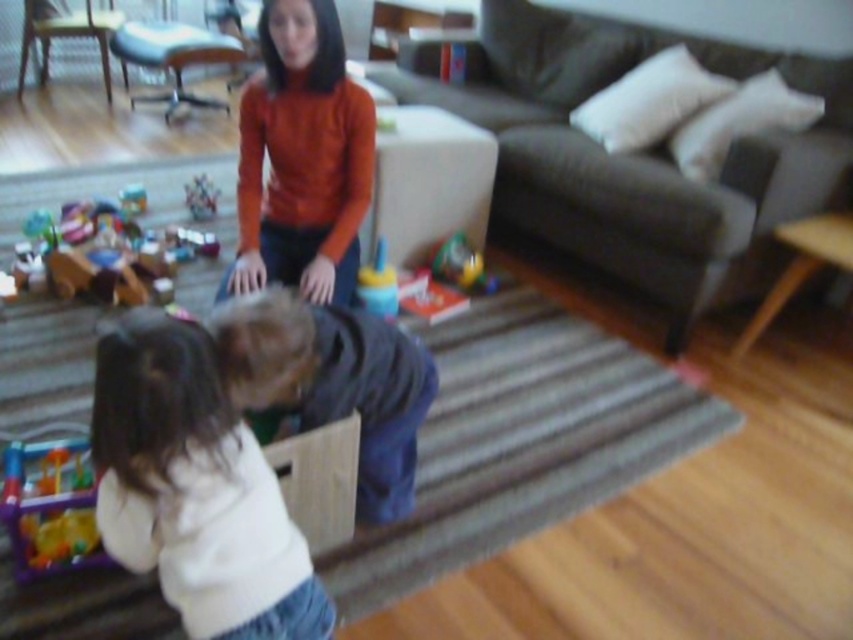
You are a parent trying to organize the toys in the living room. You see the wooden toy car at lower left and the translucent plastic toy at lower left. Which toy is positioned more to the left side of the living room?

The wooden toy car at lower left is positioned more to the left side of the living room than the translucent plastic toy at lower left.

You are a parent trying to pack up the wooden toy car at lower left and the translucent plastic toy at lower left into a storage box. The box can only fit one of them. Which toy should you choose based on their widths?

The wooden toy car at lower left might be wider than translucent plastic toy at lower left, so you should choose the wooden toy car at lower left to fit into the storage box since it is wider and might not fit both.

You are a parent trying to clean up the living room. You see the dark blue fabric at center and the matte plastic toy at center. Which item should you pick up first if you want to start with the taller object?

The dark blue fabric at center has a greater height compared to the matte plastic toy at center, so you should pick up the dark blue fabric at center first.